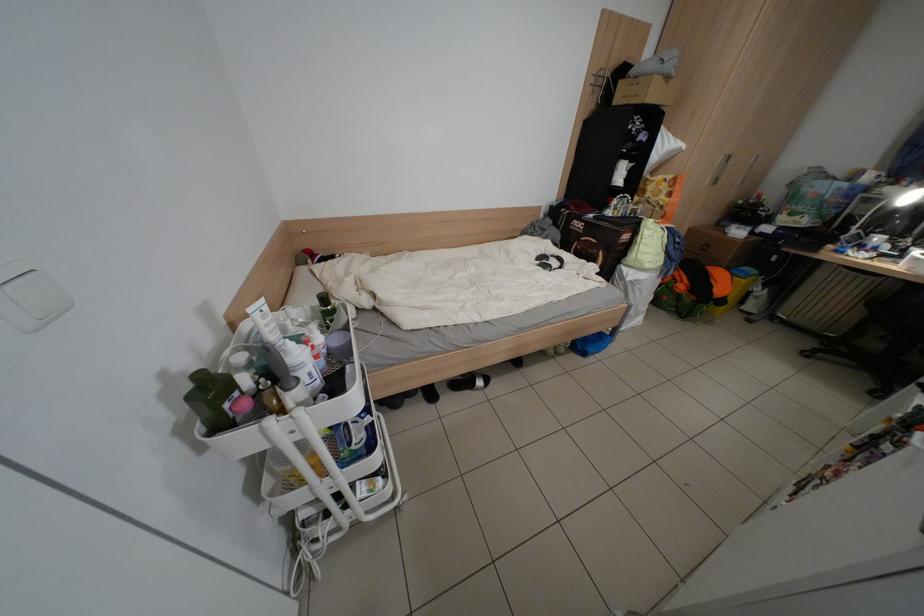
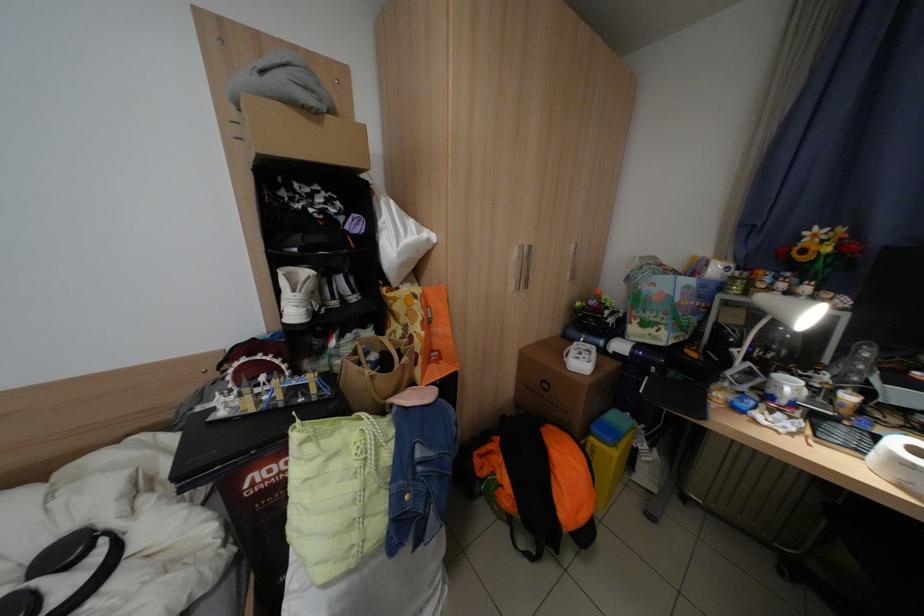
The point at (720, 182) is marked in the first image. Where is the corresponding point in the second image?

(524, 286)